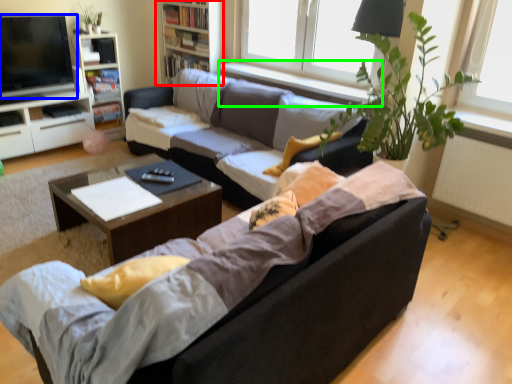
Question: Based on their relative distances, which object is farther from bookshelf (highlighted by a red box)? Choose from television (highlighted by a blue box) and window sill (highlighted by a green box).

Choices:
 (A) television
 (B) window sill

Answer: (A)